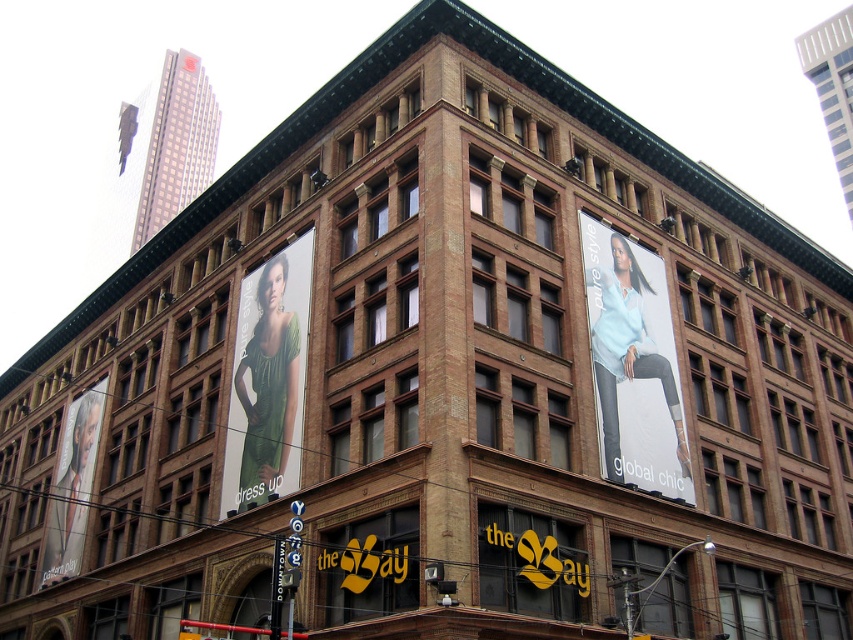
Question: Does light blue fabric at upper right appear on the left side of matte black portrait at left?

Choices:
 (A) yes
 (B) no

Answer: (B)

Question: Can you confirm if light blue fabric at upper right is wider than green fabric dress at left?

Choices:
 (A) yes
 (B) no

Answer: (A)

Question: Among these points, which one is farthest from the camera?

Choices:
 (A) (619, 342)
 (B) (78, 540)

Answer: (B)

Question: Considering the real-world distances, which object is closest to the green fabric dress at left?

Choices:
 (A) light blue fabric at upper right
 (B) matte black portrait at left

Answer: (A)

Question: Which object is farther from the camera taking this photo?

Choices:
 (A) green fabric dress at left
 (B) matte black portrait at left

Answer: (B)

Question: Does green fabric dress at left have a larger size compared to matte black portrait at left?

Choices:
 (A) yes
 (B) no

Answer: (B)